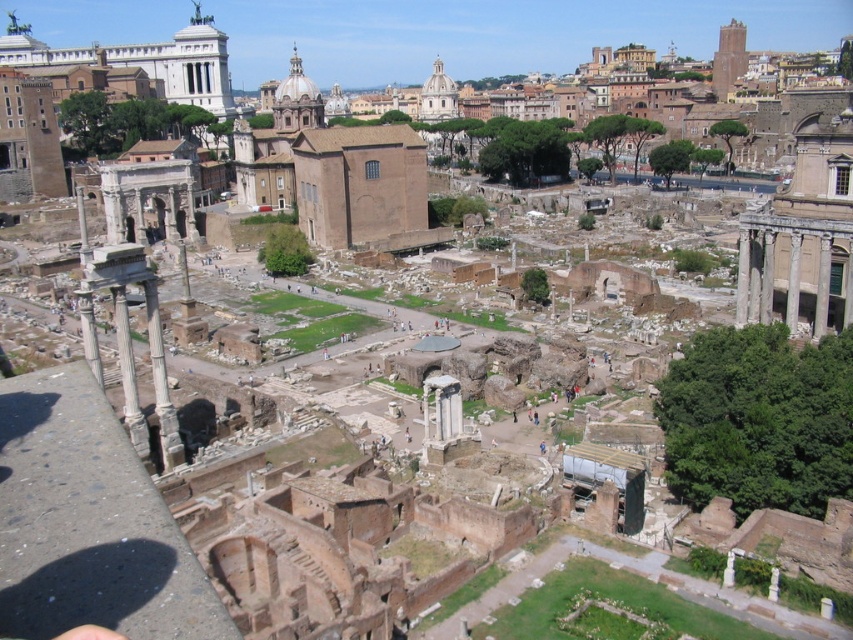
Question: Does smooth stone column at right have a larger size compared to smooth stone column at center right?

Choices:
 (A) no
 (B) yes

Answer: (B)

Question: Which is farther from the smooth stone column at left?

Choices:
 (A) white marble column at lower left
 (B) smooth stone column at center right
 (C) smooth stone column at right

Answer: (C)

Question: Which object is farther from the camera taking this photo?

Choices:
 (A) smooth stone column at left
 (B) smooth stone column at center right

Answer: (B)

Question: Is white marble column at lower left to the right of smooth stone column at center right from the viewer's perspective?

Choices:
 (A) yes
 (B) no

Answer: (B)

Question: Does white marble column at lower left appear on the left side of smooth stone column at right?

Choices:
 (A) no
 (B) yes

Answer: (B)

Question: Which point appears farthest from the camera in this image?

Choices:
 (A) (813, 323)
 (B) (785, 323)

Answer: (A)